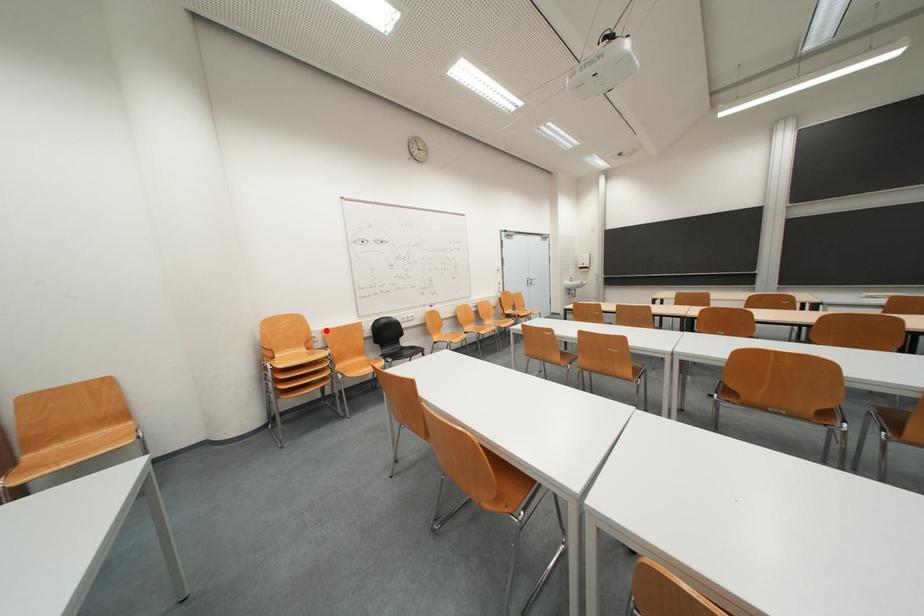
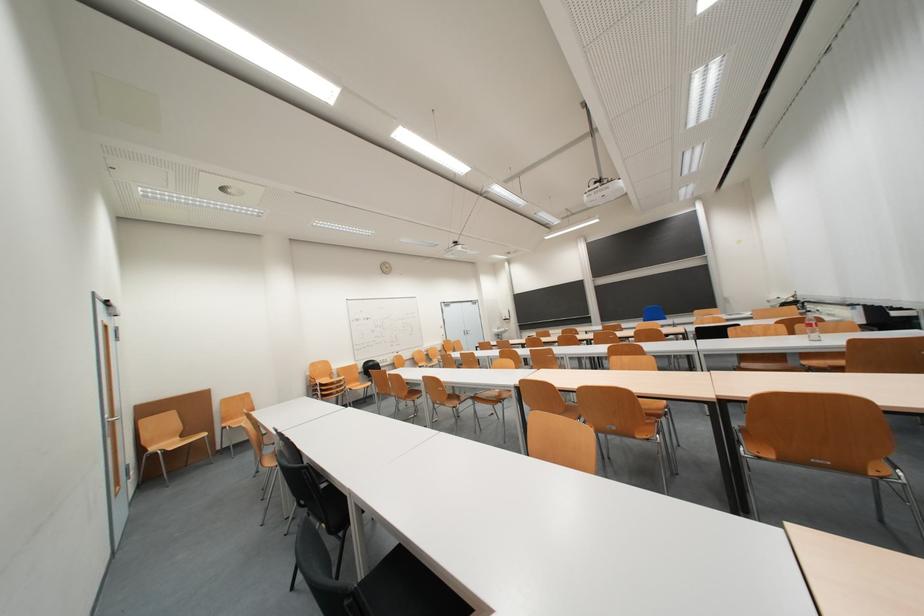
In the second image, find the point that corresponds to the highlighted location in the first image.

(343, 371)